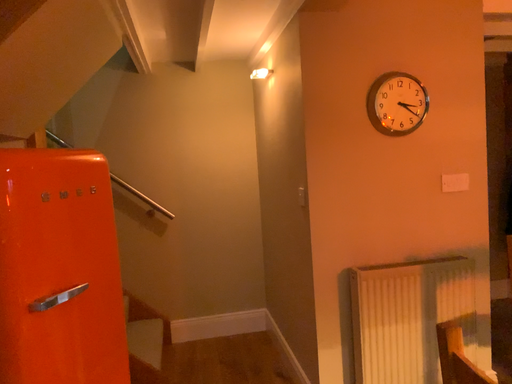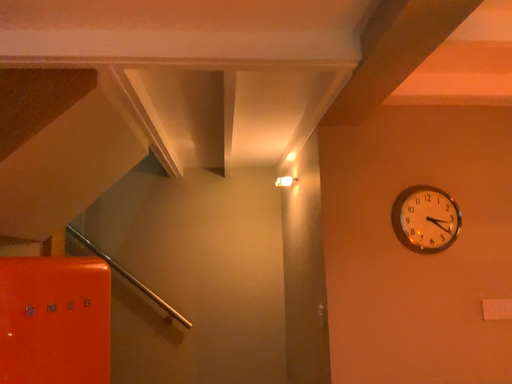
Question: How did the camera likely rotate when shooting the video?

Choices:
 (A) rotated upward
 (B) rotated downward

Answer: (A)